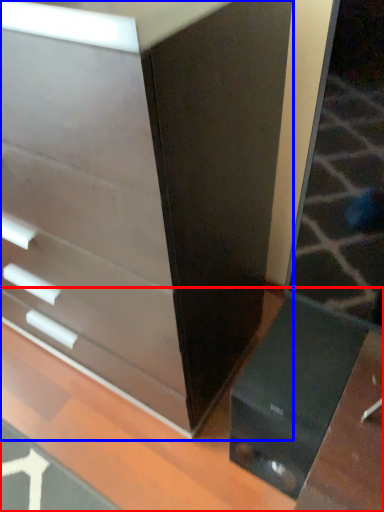
Question: Which of the following is the closest to the observer, table (highlighted by a red box) or chest of drawers (highlighted by a blue box)?

Choices:
 (A) table
 (B) chest of drawers

Answer: (A)